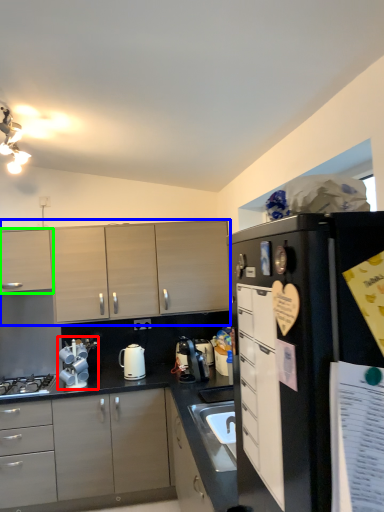
Question: Which object is positioned farthest from appliance (highlighted by a red box)? Select from cabinetry (highlighted by a blue box) and cabinetry (highlighted by a green box).

Choices:
 (A) cabinetry
 (B) cabinetry

Answer: (B)